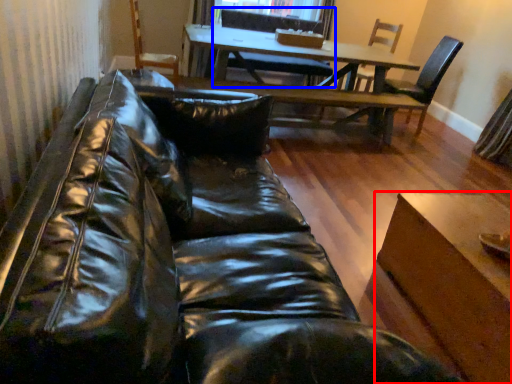
Question: Which point is closer to the camera, table (highlighted by a red box) or chair (highlighted by a blue box)?

Choices:
 (A) table
 (B) chair

Answer: (A)